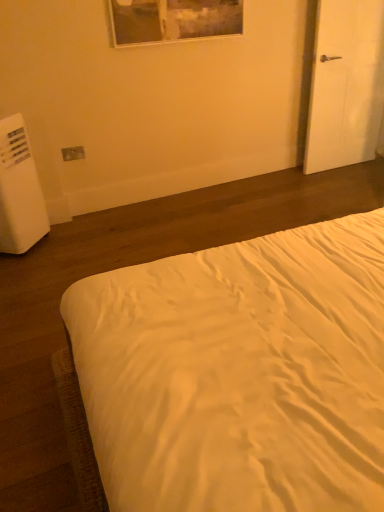
Question: Is white matte door at right closer to camera compared to white satin bed at center?

Choices:
 (A) no
 (B) yes

Answer: (A)

Question: Does white matte door at right contain white satin bed at center?

Choices:
 (A) no
 (B) yes

Answer: (A)

Question: From a real-world perspective, is white matte door at right located beneath white satin bed at center?

Choices:
 (A) yes
 (B) no

Answer: (B)

Question: From a real-world perspective, is white matte door at right located higher than white satin bed at center?

Choices:
 (A) no
 (B) yes

Answer: (B)

Question: Would you consider white matte door at right to be distant from white satin bed at center?

Choices:
 (A) yes
 (B) no

Answer: (A)

Question: From their relative heights in the image, would you say matte plastic outlet at lower left is taller or shorter than white plastic water heater at left?

Choices:
 (A) short
 (B) tall

Answer: (A)

Question: Would you say matte plastic outlet at lower left is inside or outside white plastic water heater at left?

Choices:
 (A) outside
 (B) inside

Answer: (A)

Question: Based on their sizes in the image, would you say matte plastic outlet at lower left is bigger or smaller than white plastic water heater at left?

Choices:
 (A) small
 (B) big

Answer: (A)

Question: Considering their positions, is matte plastic outlet at lower left located in front of or behind white plastic water heater at left?

Choices:
 (A) front
 (B) behind

Answer: (B)

Question: Considering the positions of matte plastic outlet at lower left and white matte door at right in the image, is matte plastic outlet at lower left bigger or smaller than white matte door at right?

Choices:
 (A) small
 (B) big

Answer: (A)

Question: From the image's perspective, relative to white matte door at right, is matte plastic outlet at lower left above or below?

Choices:
 (A) above
 (B) below

Answer: (B)

Question: From their relative heights in the image, would you say matte plastic outlet at lower left is taller or shorter than white matte door at right?

Choices:
 (A) tall
 (B) short

Answer: (B)

Question: In the image, is matte plastic outlet at lower left positioned in front of or behind white matte door at right?

Choices:
 (A) behind
 (B) front

Answer: (A)

Question: In terms of width, does white matte door at right look wider or thinner when compared to matte plastic outlet at lower left?

Choices:
 (A) thin
 (B) wide

Answer: (B)

Question: From the image's perspective, is white matte door at right located above or below matte plastic outlet at lower left?

Choices:
 (A) below
 (B) above

Answer: (B)